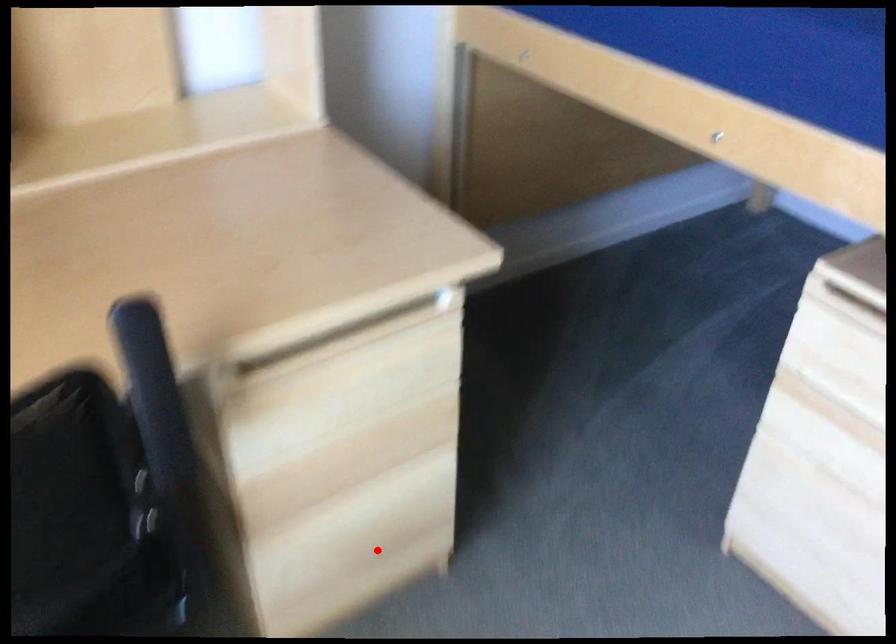
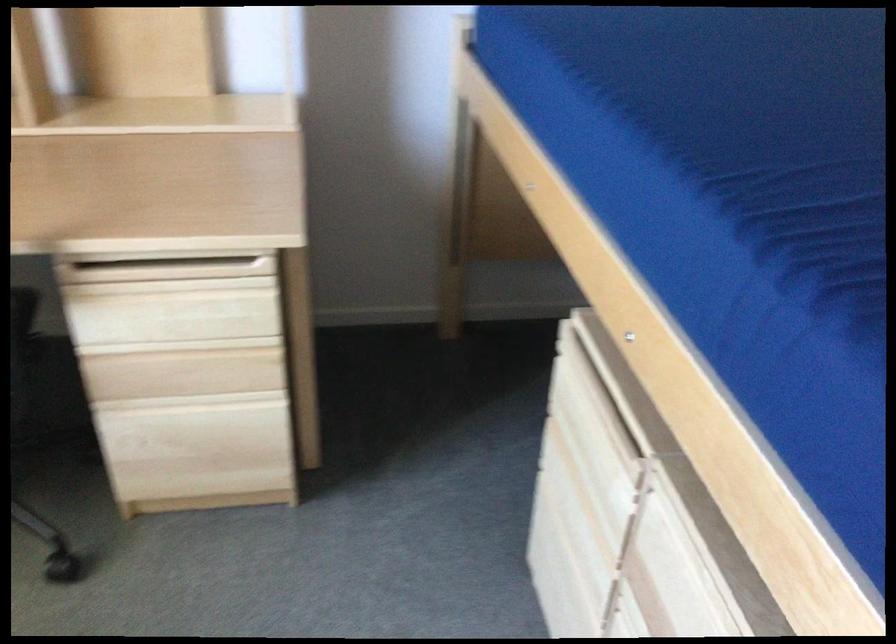
Question: I am providing you with two images of the same scene from different viewpoints. A red point is marked on the first image. Can you still see the location of the red point in image 2?

Choices:
 (A) Yes
 (B) No

Answer: (A)